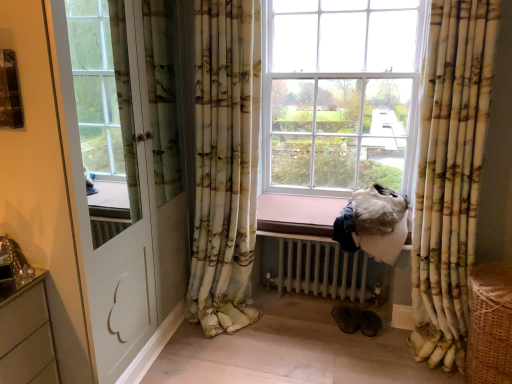
Where is `free spot to the left of floral fabric curtain at right, which is counted as the 1th curtain, starting from the right`? The width and height of the screenshot is (512, 384). free spot to the left of floral fabric curtain at right, which is counted as the 1th curtain, starting from the right is located at coordinates (370, 360).